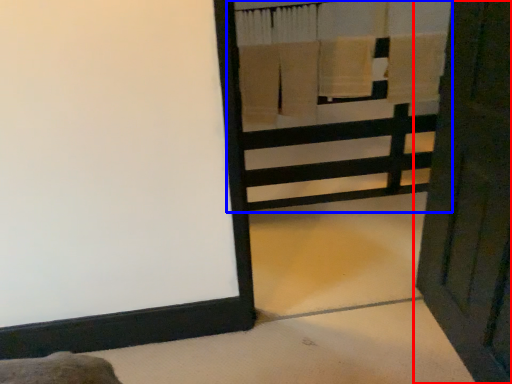
Question: Which of the following is the farthest to the observer, door (highlighted by a red box) or bunk bed (highlighted by a blue box)?

Choices:
 (A) door
 (B) bunk bed

Answer: (B)